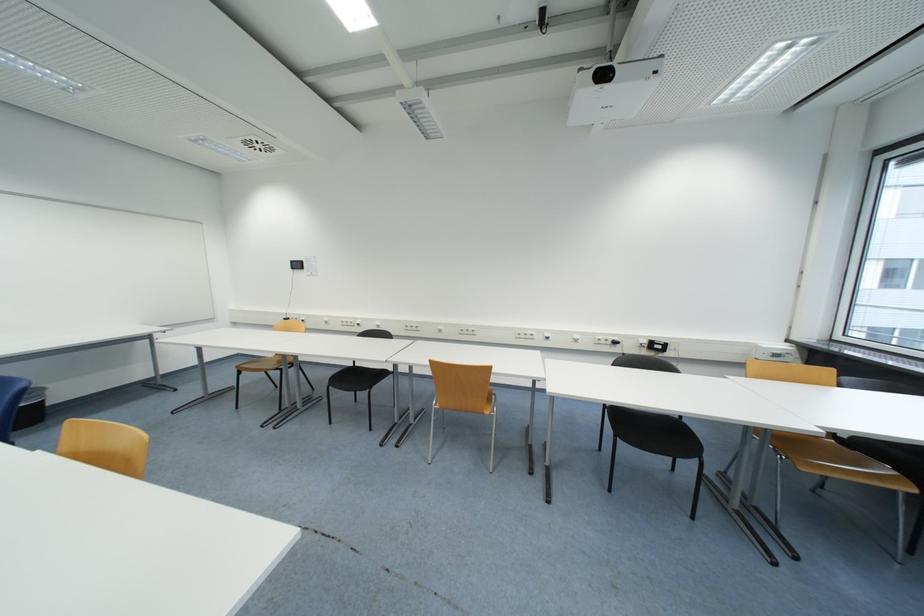
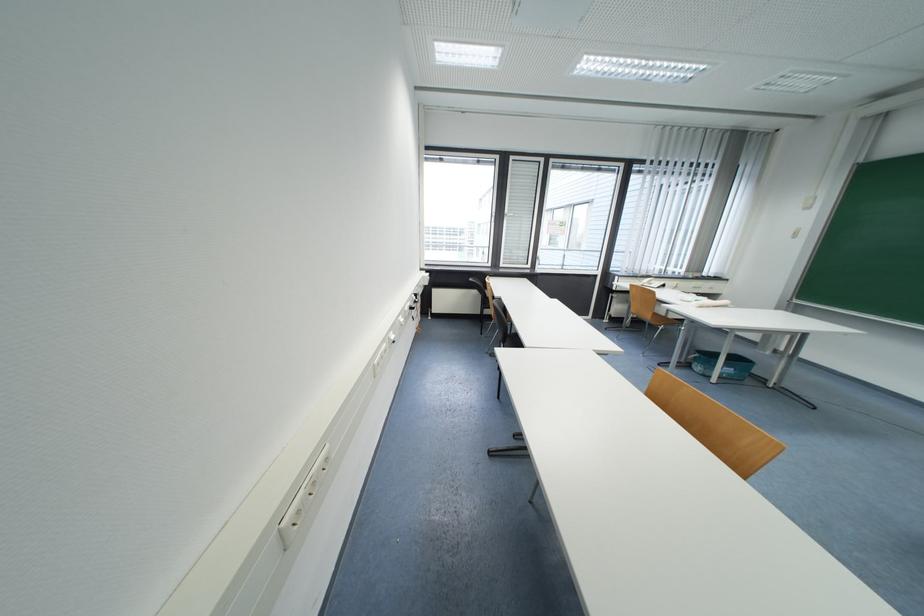
Where in the second image is the point corresponding to point (602, 339) from the first image?

(411, 310)